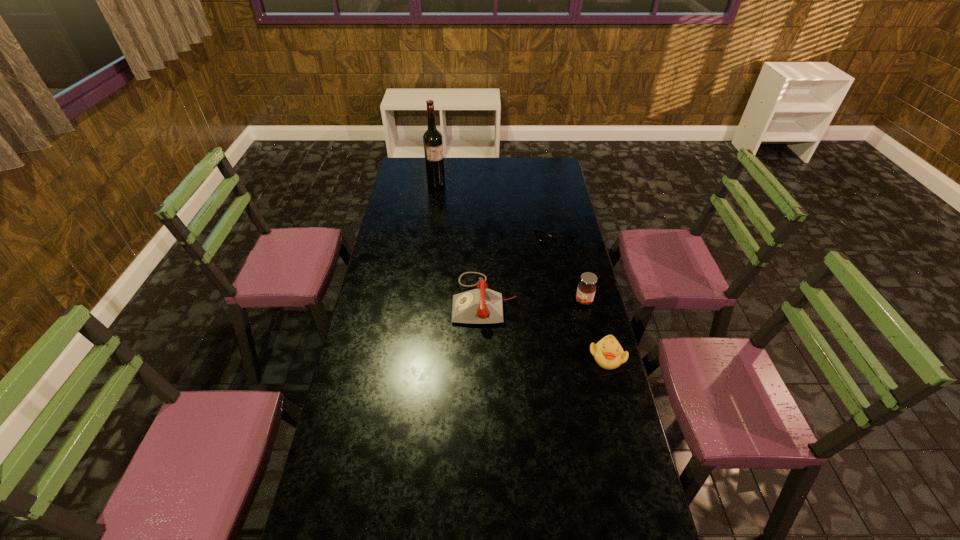
Image resolution: width=960 pixels, height=540 pixels. In order to click on vacant space on the desktop that is between the telephone and the duckling and is positioned on the front and back of the tallest object in this screenshot , I will do `click(536, 323)`.

Find the location of `free space on the desktop that is between the telephone and the nearest object and is positioned on the front-facing side of the second farthest object`. free space on the desktop that is between the telephone and the nearest object and is positioned on the front-facing side of the second farthest object is located at coordinates [530, 320].

Find the location of `vacant space on the desktop that is between the telephone and the nearest object and is positioned on the label side of the fourth shortest object`. vacant space on the desktop that is between the telephone and the nearest object and is positioned on the label side of the fourth shortest object is located at coordinates (536, 323).